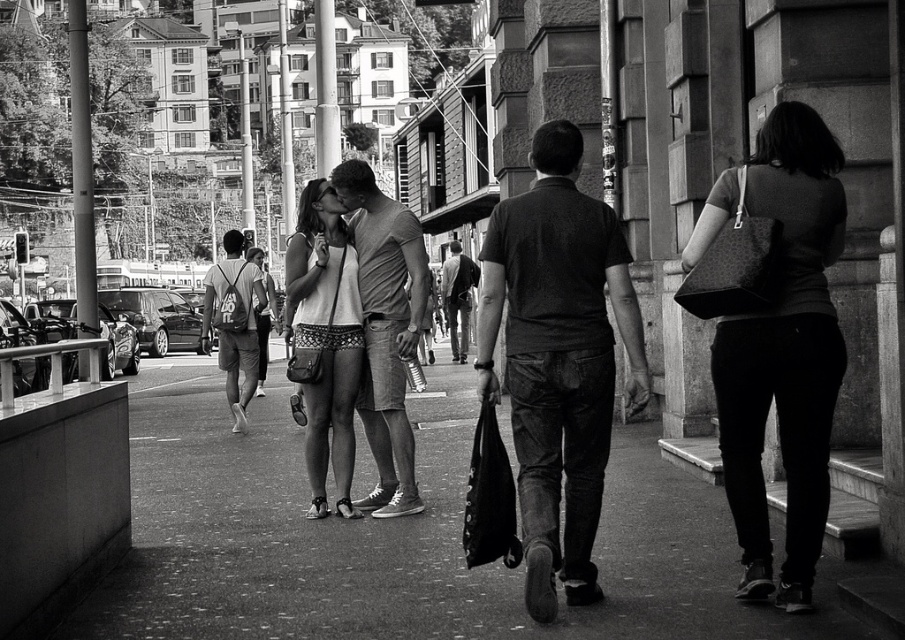
Based on the scene description, which object is positioned higher up in the image, the matte white tank top at center or the matte gray backpack at center?

The matte white tank top at center is located above the matte gray backpack at center, so it is positioned higher up in the image.

You are a photographer planning to capture a closeup shot of the dark gray shirt at center without including the smooth concrete pavement at center in the frame. Based on their sizes, is this feasible?

The smooth concrete pavement at center is bigger than dark gray shirt at center, so it might be challenging to exclude the pavement entirely due to its larger size unless the camera is positioned very close to the shirt.

You are a photographer trying to capture the couple in the foreground without any obstructions. Which object between the smooth concrete pavement at center and the matte gray backpack at center is closer to you and would block your view?

The smooth concrete pavement at center is closer to the viewer than the matte gray backpack at center, so it would block your view.